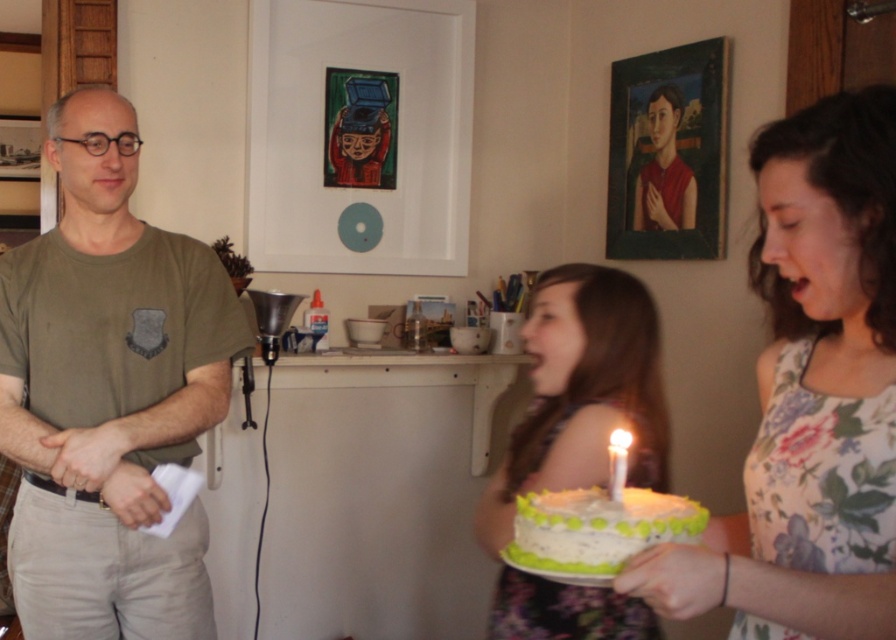
Can you confirm if white frosted cake at center is shorter than green frosted cake at center?

In fact, white frosted cake at center may be taller than green frosted cake at center.

Measure the distance from white frosted cake at center to green frosted cake at center.

They are 15.66 inches apart.

This screenshot has width=896, height=640. What do you see at coordinates (582, 392) in the screenshot? I see `white frosted cake at center` at bounding box center [582, 392].

Where is `white frosted cake at center`? This screenshot has height=640, width=896. white frosted cake at center is located at coordinates (582, 392).

Which is more to the left, white frosted cake at center or white wax candle at center?

Positioned to the left is white wax candle at center.

Is white frosted cake at center thinner than white wax candle at center?

→ No, white frosted cake at center is not thinner than white wax candle at center.

I want to click on white frosted cake at center, so click(582, 392).

This screenshot has width=896, height=640. I want to click on white frosted cake at center, so (582, 392).

Is green frosted cake at center in front of matte black shirt at center?

Yes, it is.

Can you confirm if green frosted cake at center is positioned to the right of matte black shirt at center?

No, green frosted cake at center is not to the right of matte black shirt at center.

Locate an element on the screen. green frosted cake at center is located at coordinates (595, 531).